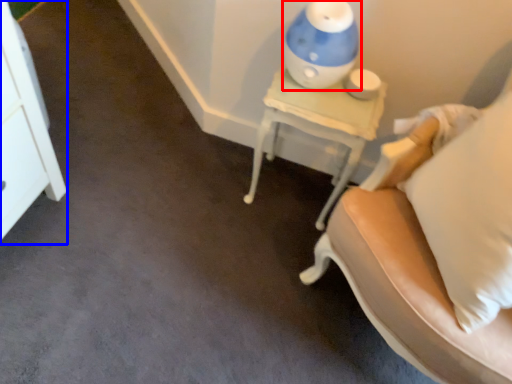
Question: Among these objects, which one is farthest to the camera, table lamp (highlighted by a red box) or dresser (highlighted by a blue box)?

Choices:
 (A) table lamp
 (B) dresser

Answer: (B)